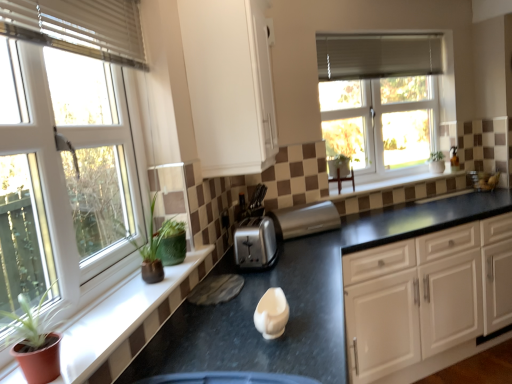
Where is `white matte cabinet at upper center, the first cabinetry positioned from the top`? white matte cabinet at upper center, the first cabinetry positioned from the top is located at coordinates coord(229,85).

What is the approximate height of white matte cabinet at upper center, arranged as the second cabinetry when viewed from the right?

It is 32.95 inches.

What do you see at coordinates (381, 100) in the screenshot? Image resolution: width=512 pixels, height=384 pixels. I see `matte glass window at upper right, the 2th window from the front` at bounding box center [381, 100].

Locate an element on the screen. This screenshot has height=384, width=512. brown tile at upper center is located at coordinates (402, 184).

What do you see at coordinates (125, 322) in the screenshot?
I see `matte green plant at left` at bounding box center [125, 322].

Locate an element on the screen. white matte cabinet at upper center, arranged as the second cabinetry when viewed from the right is located at coordinates (229, 85).

Is matte green plant at left surrounding white fabric blinds at upper left, positioned as the 1th blind in bottom-to-top order?

No, white fabric blinds at upper left, positioned as the 1th blind in bottom-to-top order, is not inside matte green plant at left.

Is matte green plant at left oriented away from white fabric blinds at upper left, positioned as the 1th blind in bottom-to-top order?

No, matte green plant at left is not facing the opposite direction of white fabric blinds at upper left, positioned as the 1th blind in bottom-to-top order.

Considering the points (126, 285) and (95, 38), which point is in front, point (126, 285) or point (95, 38)?

The point (95, 38) is in front.

From a real-world perspective, is matte green plant at left beneath white fabric blinds at upper left, which ranks as the first blind in left-to-right order?

Indeed, from a real-world perspective, matte green plant at left is positioned beneath white fabric blinds at upper left, which ranks as the first blind in left-to-right order.

Can you tell me how much matte green plant at left and white plastic window at left, which appears as the first window when viewed from the front, differ in facing direction?

The angle between the facing direction of matte green plant at left and the facing direction of white plastic window at left, which appears as the first window when viewed from the front, is 0.00297 degrees.

From the image's perspective, which is below, matte green plant at left or white plastic window at left, which is counted as the second window, starting from the back?

From the image's view, matte green plant at left is below.

From a real-world perspective, which object rests below the other?

matte green plant at left is physically lower.

Does point (130, 329) lie in front of point (133, 192)?

Yes, it is in front of point (133, 192).

How different are the orientations of white fabric blinds at upper left, positioned as the 1th blind in bottom-to-top order, and green matte plant at left in degrees?

The facing directions of white fabric blinds at upper left, positioned as the 1th blind in bottom-to-top order, and green matte plant at left are 0.755 degrees apart.

In the image, there is a white fabric blinds at upper left, the first blind in the front-to-back sequence. Where is `houseplant below it (from a real-world perspective)`? This screenshot has height=384, width=512. houseplant below it (from a real-world perspective) is located at coordinates (35, 340).

Is white fabric blinds at upper left, positioned as the 1th blind in bottom-to-top order, directly adjacent to green matte plant at left?

No, white fabric blinds at upper left, positioned as the 1th blind in bottom-to-top order, is not making contact with green matte plant at left.

From the image's perspective, is white matte cabinet at center, acting as the 1th cabinetry starting from the right, on top of matte green plant at left?

No, from the image's perspective, white matte cabinet at center, acting as the 1th cabinetry starting from the right, is not over matte green plant at left.

Which object is thinner, white matte cabinet at center, which is the 1th cabinetry from bottom to top, or matte green plant at left?

Thinner between the two is matte green plant at left.

Considering the relative sizes of white matte cabinet at center, acting as the 2th cabinetry starting from the left, and matte green plant at left in the image provided, is white matte cabinet at center, acting as the 2th cabinetry starting from the left, bigger than matte green plant at left?

Yes.

Between point (437, 330) and point (85, 349), which one is positioned in front?

The point (85, 349) is closer to the camera.

Which object is wider, white matte cabinet at upper center, the first cabinetry positioned from the top, or satin silver toaster at center, arranged as the first appliance when viewed from the right?

white matte cabinet at upper center, the first cabinetry positioned from the top.

What's the angular difference between white matte cabinet at upper center, which ranks as the 1th cabinetry in left-to-right order, and satin silver toaster at center, placed as the 2th appliance when sorted from front to back,'s facing directions?

55.4 degrees separate the facing orientations of white matte cabinet at upper center, which ranks as the 1th cabinetry in left-to-right order, and satin silver toaster at center, placed as the 2th appliance when sorted from front to back.

Could you tell me if white matte cabinet at upper center, the first cabinetry positioned from the top, is turned towards satin silver toaster at center, placed as the 2th appliance when sorted from left to right?

No, white matte cabinet at upper center, the first cabinetry positioned from the top, is not aimed at satin silver toaster at center, placed as the 2th appliance when sorted from left to right.

From the picture: Could you measure the distance between white matte cabinet at upper center, arranged as the second cabinetry when viewed from the right, and satin silver toaster at center, the first appliance from the back?

The distance of white matte cabinet at upper center, arranged as the second cabinetry when viewed from the right, from satin silver toaster at center, the first appliance from the back, is 28.68 inches.

Are green matte plant at left and white fabric blinds at upper left, which is the 2th blind from back to front, far apart?

No.

From a real-world perspective, between green matte plant at left and white fabric blinds at upper left, positioned as the 1th blind in bottom-to-top order, who is vertically lower?

green matte plant at left, from a real-world perspective.

Can you tell me how much green matte plant at left and white fabric blinds at upper left, which ranks as the first blind in left-to-right order, differ in facing direction?

0.755 degrees separate the facing orientations of green matte plant at left and white fabric blinds at upper left, which ranks as the first blind in left-to-right order.

Considering the relative positions of green matte plant at left and white fabric blinds at upper left, which is the second blind from top to bottom, in the image provided, is green matte plant at left to the left of white fabric blinds at upper left, which is the second blind from top to bottom, from the viewer's perspective?

No.

Is point (256, 219) closer or farther from the camera than point (456, 180)?

Point (256, 219).

Is satin silver toaster at center, marked as the second appliance in a back-to-front arrangement, smaller than brown tile at upper center?

Correct, satin silver toaster at center, marked as the second appliance in a back-to-front arrangement, occupies less space than brown tile at upper center.

Is satin silver toaster at center, marked as the 1th appliance in a front-to-back arrangement, positioned in front of brown tile at upper center?

Yes, satin silver toaster at center, marked as the 1th appliance in a front-to-back arrangement, is in front of brown tile at upper center.

From the picture: From the image's perspective, is satin silver toaster at center, which is the first appliance from left to right, located above or below brown tile at upper center?

Based on their image positions, satin silver toaster at center, which is the first appliance from left to right, is located beneath brown tile at upper center.

From a real-world perspective, count 1st blinds upward from the matte green plant at left and point to it. Please provide its 2D coordinates.

[(79, 27)]

At what (x,y) coordinates should I click in order to perform the action: click on counter directly beneath the white plastic window at left, which is counted as the second window, starting from the back (from a real-world perspective). Please return your answer as a coordinate pair (x, y). The image size is (512, 384). Looking at the image, I should click on (125, 322).

Estimate the real-world distances between objects in this image. Which object is closer to white fabric blind at upper right, which ranks as the second blind in left-to-right order, white matte cabinet at center, which is the 1th cabinetry from bottom to top, or white fabric blinds at upper left, the second blind viewed from the right?

Based on the image, white matte cabinet at center, which is the 1th cabinetry from bottom to top, appears to be nearer to white fabric blind at upper right, which ranks as the second blind in left-to-right order.

Estimate the real-world distances between objects in this image. Which object is closer to white matte cabinet at upper center, the first cabinetry positioned from the top, green matte plant at left or black granite countertop at center?

The object closer to white matte cabinet at upper center, the first cabinetry positioned from the top, is green matte plant at left.

From the image, which object appears to be nearer to white plastic window at left, the second window from the right, white matte cabinet at upper center, the first cabinetry positioned from the top, or white matte cabinet at center, acting as the 2th cabinetry starting from the left?

white matte cabinet at upper center, the first cabinetry positioned from the top.

Looking at the image, which one is located further to white fabric blind at upper right, the first blind when ordered from right to left, matte green plant at left or satin silver toaster at center, arranged as the first appliance when viewed from the right?

The object further to white fabric blind at upper right, the first blind when ordered from right to left, is matte green plant at left.

In the scene shown: Considering their positions, is white plastic window at left, which appears as the first window when viewed from the left, positioned further to satin silver toaster at center, placed as the 2th appliance when sorted from left to right, than white matte cabinet at center, acting as the 1th cabinetry starting from the right?

white plastic window at left, which appears as the first window when viewed from the left, lies further to satin silver toaster at center, placed as the 2th appliance when sorted from left to right, than the other object.

From the picture: Estimate the real-world distances between objects in this image. Which object is closer to satin silver toaster at center, placed as the 2th appliance when sorted from left to right, white matte cabinet at center, which is the 2th cabinetry from top to bottom, or green matte plant at left?

white matte cabinet at center, which is the 2th cabinetry from top to bottom.

Which object lies nearer to the anchor point white plastic window at left, which appears as the first window when viewed from the left, white fabric blind at upper right, the first blind when ordered from right to left, or satin silver toaster at center, marked as the 1th appliance in a front-to-back arrangement?

satin silver toaster at center, marked as the 1th appliance in a front-to-back arrangement, is closer to white plastic window at left, which appears as the first window when viewed from the left.

Considering their positions, is satin silver toaster at center, placed as the 2th appliance when sorted from left to right, positioned further to white matte cabinet at center, which is the 2th cabinetry from top to bottom, than white fabric blinds at upper left, the second blind viewed from the right?

white fabric blinds at upper left, the second blind viewed from the right, is further to white matte cabinet at center, which is the 2th cabinetry from top to bottom.

Locate an element on the screen. countertop between green matte plant at left and brown tile at upper center is located at coordinates (297, 297).

Locate an element on the screen. cabinetry located between white plastic window at left, the second window from the right, and black granite countertop at center in the left-right direction is located at coordinates (229, 85).

Locate an element on the screen. houseplant between white plastic window at left, which appears as the first window when viewed from the left, and matte green plant at left from top to bottom is located at coordinates (35, 340).

The image size is (512, 384). Identify the location of cabinetry between green matte plant at left and white matte cabinet at center, acting as the 2th cabinetry starting from the left, in the horizontal direction. (229, 85).